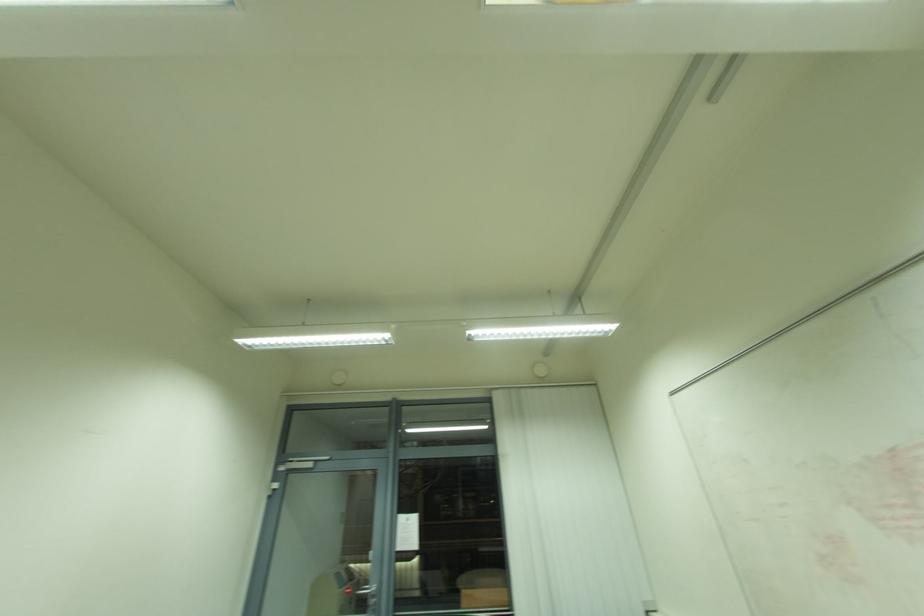
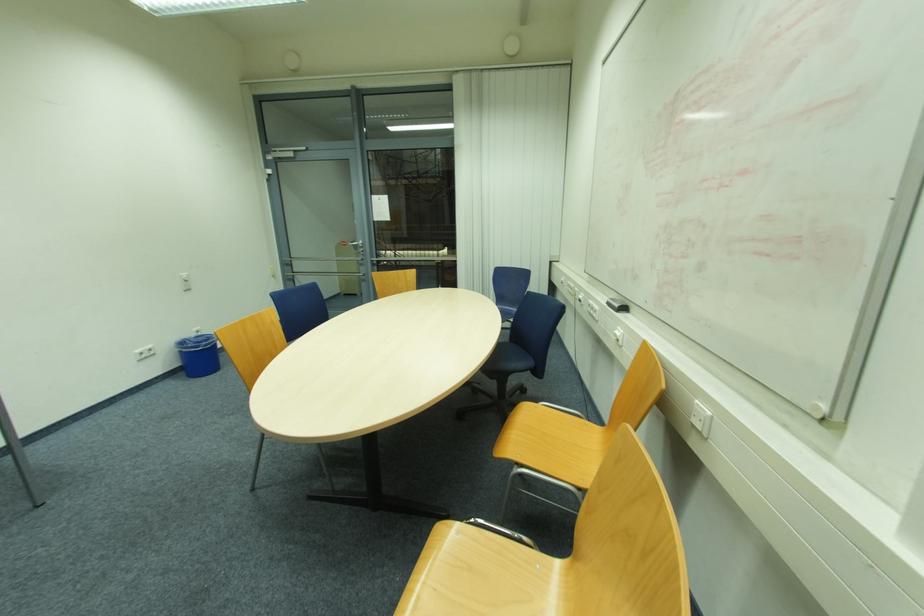
Question: The images are taken continuously from a first-person perspective. In which direction is your viewpoint rotating?

Choices:
 (A) Left
 (B) Right
 (C) Up
 (D) Down

Answer: (D)